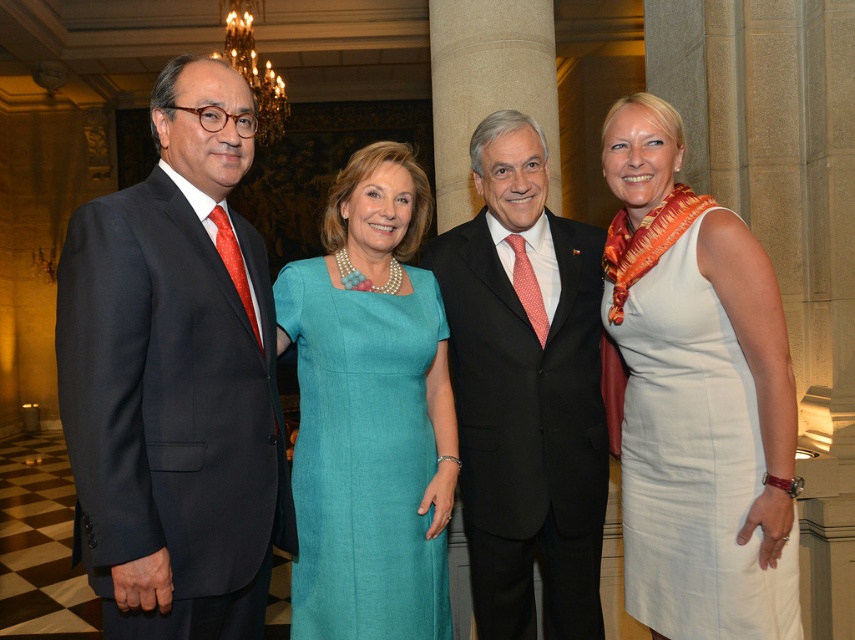
Is black suit at center to the left of teal fabric dress at center from the viewer's perspective?

Incorrect, black suit at center is not on the left side of teal fabric dress at center.

Which is behind, point (445, 230) or point (429, 352)?

The point (445, 230) is more distant.

At what (x,y) coordinates should I click in order to perform the action: click on black suit at center. Please return your answer as a coordinate pair (x, y). The width and height of the screenshot is (855, 640). Looking at the image, I should click on (526, 390).

The image size is (855, 640). Describe the element at coordinates (526, 390) in the screenshot. I see `black suit at center` at that location.

Does black suit at center have a smaller size compared to white satin dress at right?

Actually, black suit at center might be larger than white satin dress at right.

What do you see at coordinates (526, 390) in the screenshot? This screenshot has width=855, height=640. I see `black suit at center` at bounding box center [526, 390].

This screenshot has height=640, width=855. I want to click on black suit at center, so click(526, 390).

Is matte black suit at left shorter than white satin dress at right?

No, matte black suit at left is not shorter than white satin dress at right.

Find the location of a particular element. This screenshot has width=855, height=640. matte black suit at left is located at coordinates (175, 380).

Does point (103, 358) come closer to viewer compared to point (640, 260)?

Yes, point (103, 358) is closer to viewer.

Where is `matte black suit at left`? matte black suit at left is located at coordinates [175, 380].